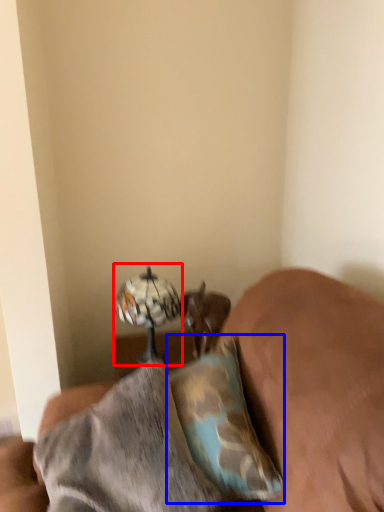
Question: Which object is closer to the camera taking this photo, table lamp (highlighted by a red box) or pillow (highlighted by a blue box)?

Choices:
 (A) table lamp
 (B) pillow

Answer: (B)